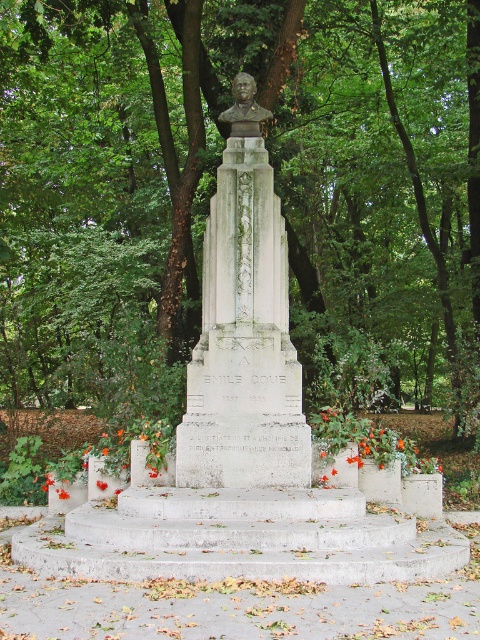
Between point (420, 45) and point (250, 113), which one is positioned behind?

Positioned behind is point (420, 45).

In the scene shown: Is green leafy tree at center below matte bronze bust at center?

Yes, green leafy tree at center is below matte bronze bust at center.

The height and width of the screenshot is (640, 480). Find the location of `green leafy tree at center`. green leafy tree at center is located at coordinates (214, 186).

Image resolution: width=480 pixels, height=640 pixels. What do you see at coordinates (368, 442) in the screenshot? I see `orange fabric flower at lower center` at bounding box center [368, 442].

Between orange fabric flower at lower center and matte bronze bust at center, which one has less height?

With less height is orange fabric flower at lower center.

Locate an element on the screen. The height and width of the screenshot is (640, 480). orange fabric flower at lower center is located at coordinates (368, 442).

Is gray stone bust at center to the left of orange fabric flower at lower center from the viewer's perspective?

Indeed, gray stone bust at center is positioned on the left side of orange fabric flower at lower center.

Can you confirm if gray stone bust at center is bigger than orange fabric flower at lower center?

Yes.

In order to click on gray stone bust at center in this screenshot , I will do `click(243, 330)`.